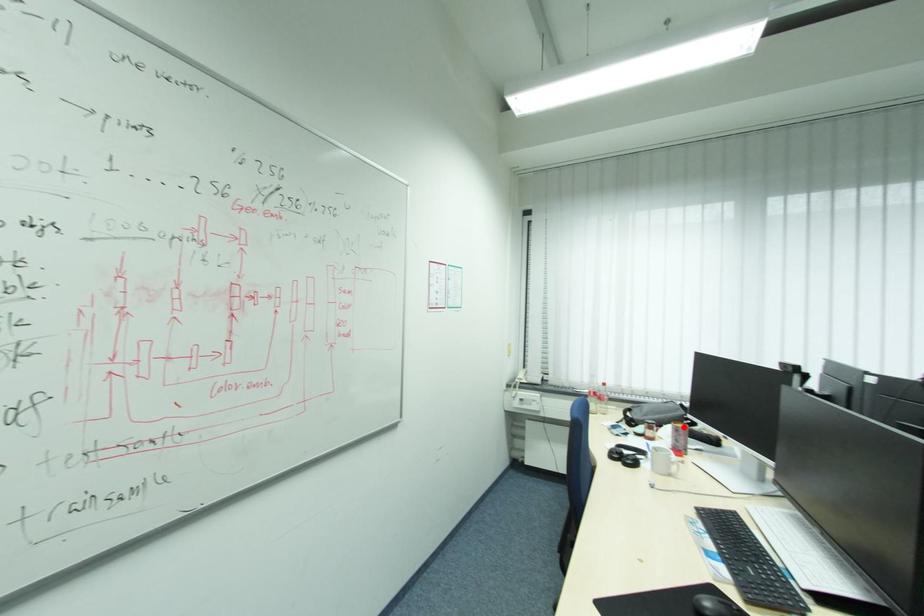
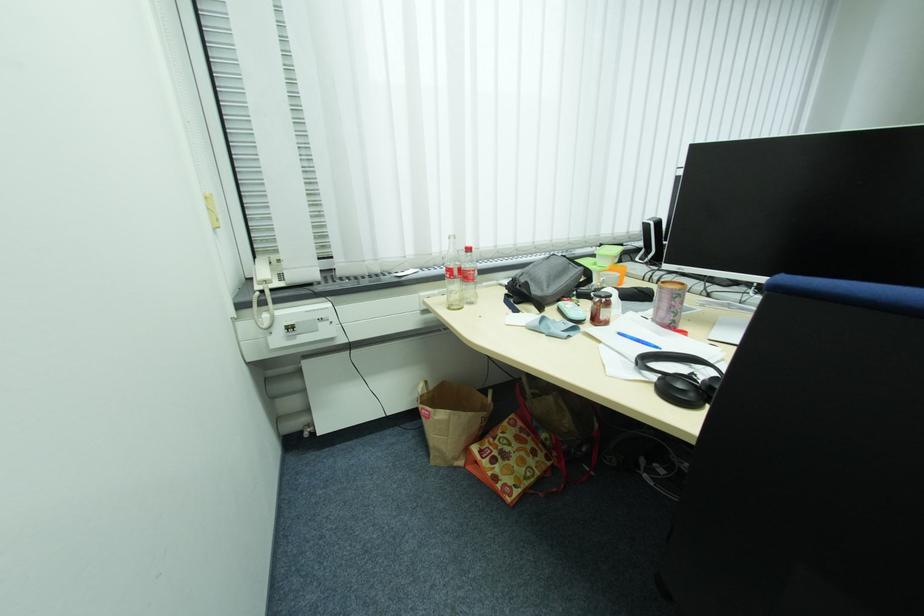
Question: I am providing you with two images of the same scene from different viewpoints. A red point is marked on the first image. Is the red point's position out of view in image 2?

Choices:
 (A) Yes
 (B) No

Answer: (B)